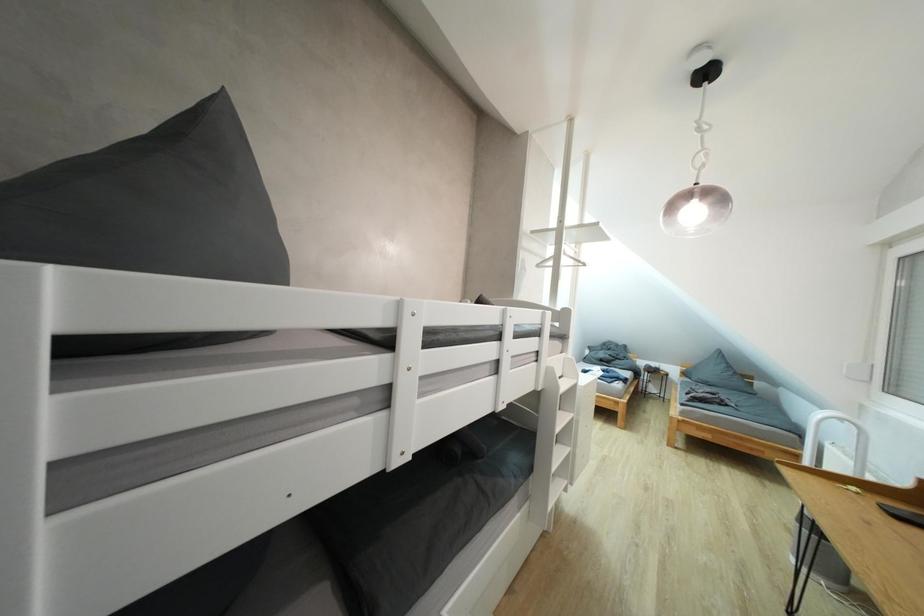
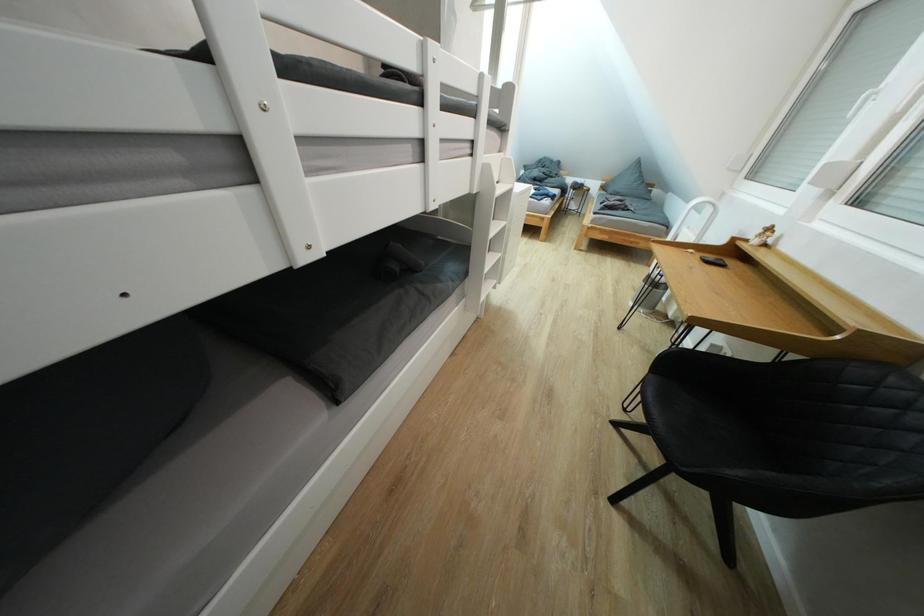
Question: Based on the continuous images, in which direction is the camera rotating? Reply with the corresponding letter.

Choices:
 (A) Left
 (B) Right
 (C) Up
 (D) Down

Answer: (D)